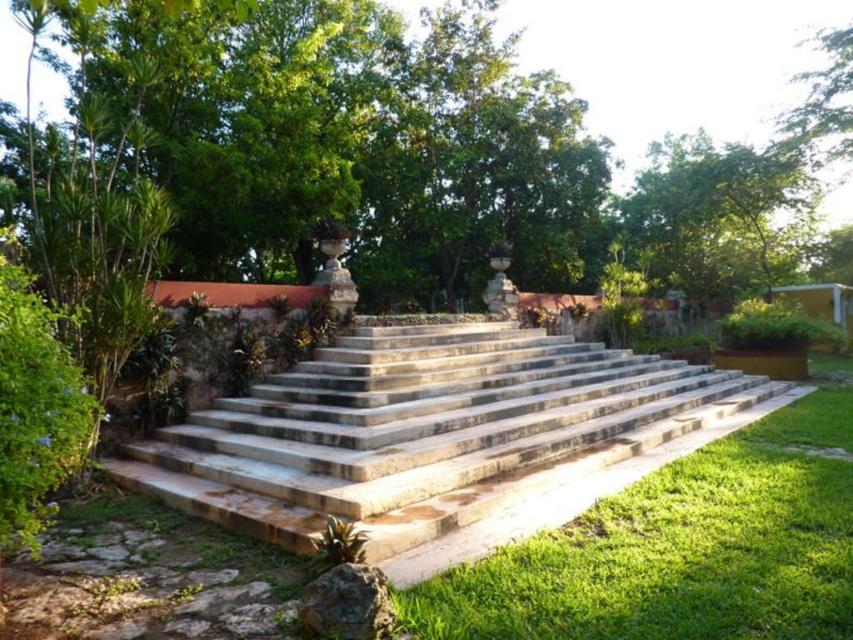
From the picture: You are standing at the bottom of the stone steps looking up. You notice the green grass at lower center and the green leafy tree at upper right. Which one appears closer to you?

The green grass at lower center appears closer to you because it has a smaller size compared to the green leafy tree at upper right, which is farther away.

You are planning to install a new pathway in your garden. The natural stone stairs at center and the green grass at lower center are part of the existing layout. Which of these two elements occupies a greater area in the current design?

The natural stone stairs at center is larger in size than green grass at lower center, so it occupies a greater area in the current design.

You are standing at the bottom of the stone steps and want to reach the raised platform. Which direction should you walk to avoid the green grass at lower center?

To avoid the green grass at lower center, you should walk towards the stone steps since the green grass at lower center is located at point (683, 547), which is away from the steps leading up to the platform.